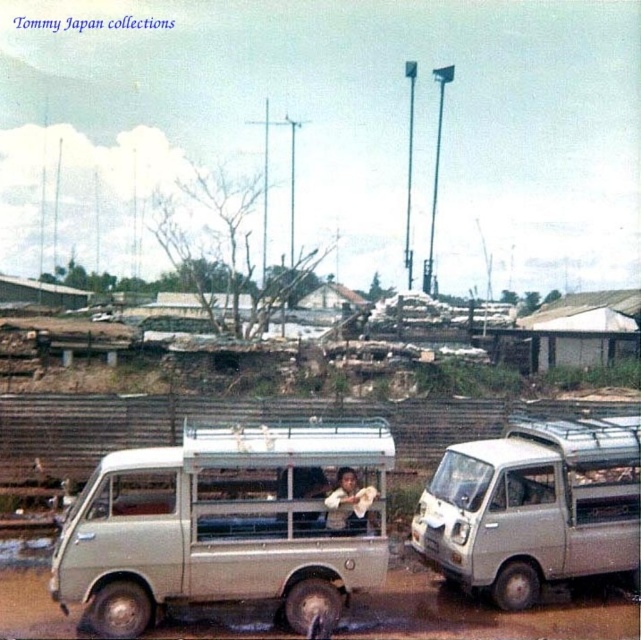
Who is lower down, beige matte van at center or silver metallic van at center?

Positioned lower is beige matte van at center.

What are the coordinates of `beige matte van at center` in the screenshot? It's located at (228, 524).

Locate an element on the screen. The height and width of the screenshot is (640, 641). beige matte van at center is located at coordinates (228, 524).